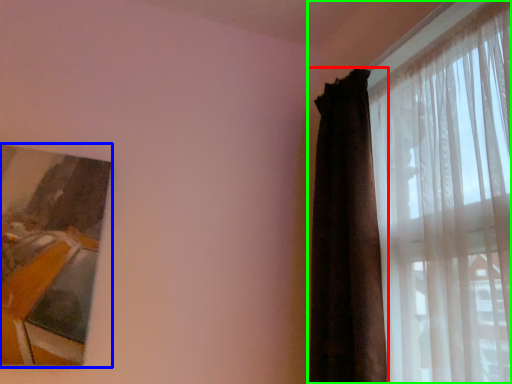
Question: Estimate the real-world distances between objects in this image. Which object is farther from curtain (highlighted by a red box), picture frame (highlighted by a blue box) or curtain (highlighted by a green box)?

Choices:
 (A) picture frame
 (B) curtain

Answer: (A)